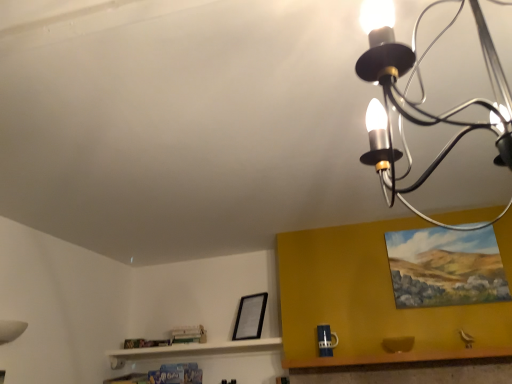
Question: From the image's perspective, is wooden table at lower right over black matte picture frame at lower center, which is counted as the 2th picture frame, starting from the right?

Choices:
 (A) yes
 (B) no

Answer: (B)

Question: Can you confirm if wooden table at lower right is smaller than black matte picture frame at lower center, the second picture frame in the top-to-bottom sequence?

Choices:
 (A) yes
 (B) no

Answer: (B)

Question: From a real-world perspective, is wooden table at lower right beneath black matte picture frame at lower center, the 1th picture frame when ordered from left to right?

Choices:
 (A) no
 (B) yes

Answer: (B)

Question: Is wooden table at lower right not within black matte picture frame at lower center, the second picture frame in the top-to-bottom sequence?

Choices:
 (A) yes
 (B) no

Answer: (A)

Question: Is black matte picture frame at lower center, the second picture frame in the top-to-bottom sequence, surrounded by wooden table at lower right?

Choices:
 (A) no
 (B) yes

Answer: (A)

Question: Is wooden table at lower right thinner than black matte picture frame at lower center, the 1th picture frame when ordered from left to right?

Choices:
 (A) yes
 (B) no

Answer: (B)

Question: From a real-world perspective, is oil painting at upper right, which is counted as the 2th picture frame, starting from the left, physically below black metal chandelier at upper right?

Choices:
 (A) yes
 (B) no

Answer: (B)

Question: Is oil painting at upper right, which is counted as the 2th picture frame, starting from the left, further to the viewer compared to black metal chandelier at upper right?

Choices:
 (A) yes
 (B) no

Answer: (A)

Question: Can you confirm if oil painting at upper right, which ranks as the 1th picture frame in right-to-left order, is positioned to the left of black metal chandelier at upper right?

Choices:
 (A) no
 (B) yes

Answer: (A)

Question: Is oil painting at upper right, the second picture frame from the bottom, positioned before black metal chandelier at upper right?

Choices:
 (A) no
 (B) yes

Answer: (A)

Question: Does oil painting at upper right, acting as the 1th picture frame starting from the front, have a larger size compared to black metal chandelier at upper right?

Choices:
 (A) no
 (B) yes

Answer: (A)

Question: Considering the relative sizes of oil painting at upper right, the second picture frame from the bottom, and black metal chandelier at upper right in the image provided, is oil painting at upper right, the second picture frame from the bottom, shorter than black metal chandelier at upper right?

Choices:
 (A) no
 (B) yes

Answer: (B)

Question: From a real-world perspective, is oil painting at upper right, which ranks as the 1th picture frame in right-to-left order, on black matte picture frame at lower center, positioned as the first picture frame in bottom-to-top order?

Choices:
 (A) no
 (B) yes

Answer: (B)